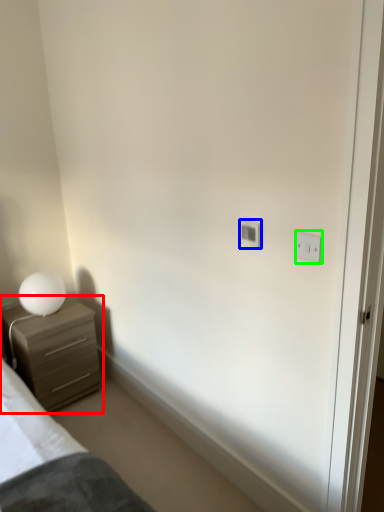
Question: Which object is positioned closest to chest of drawers (highlighted by a red box)? Select from light switch (highlighted by a blue box) and light switch (highlighted by a green box).

Choices:
 (A) light switch
 (B) light switch

Answer: (A)